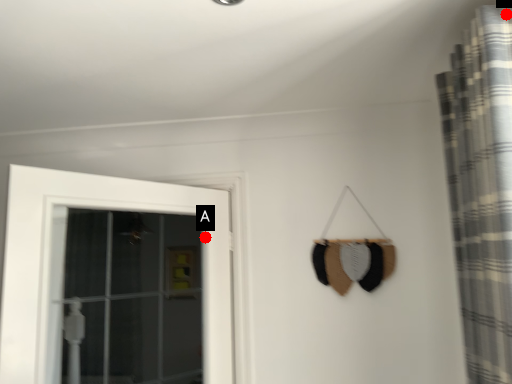
Question: Two points are circled on the image, labeled by A and B beside each circle. Which point appears closest to the camera in this image?

Choices:
 (A) A is closer
 (B) B is closer

Answer: (B)